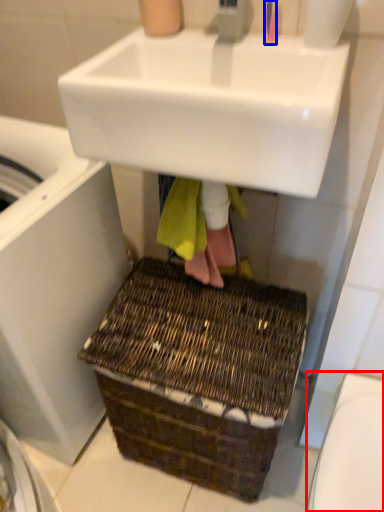
Question: Which object is closer to the camera taking this photo, toilet bowl (highlighted by a red box) or toothbrush (highlighted by a blue box)?

Choices:
 (A) toilet bowl
 (B) toothbrush

Answer: (A)